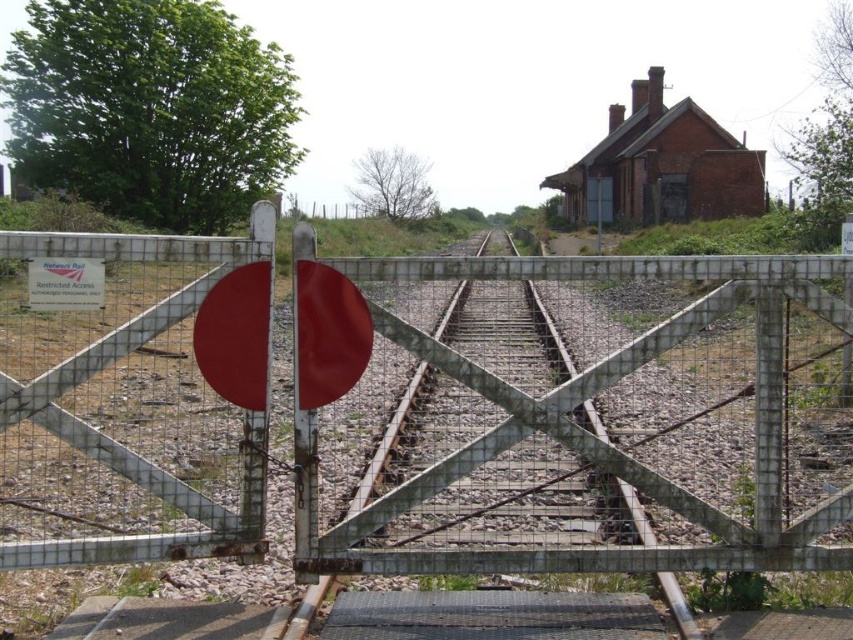
Question: Does metal mesh gate at center appear over smooth metal train track at center?

Choices:
 (A) yes
 (B) no

Answer: (A)

Question: From the image, what is the correct spatial relationship of metal mesh gate at center in relation to smooth metal train track at center?

Choices:
 (A) right
 (B) left

Answer: (B)

Question: Which point is closer to the camera taking this photo?

Choices:
 (A) (546, 548)
 (B) (599, 461)

Answer: (B)

Question: Which of the following is the closest to the observer?

Choices:
 (A) smooth metal train track at center
 (B) metal mesh gate at center

Answer: (B)

Question: Is metal mesh gate at center thinner than smooth metal train track at center?

Choices:
 (A) yes
 (B) no

Answer: (B)